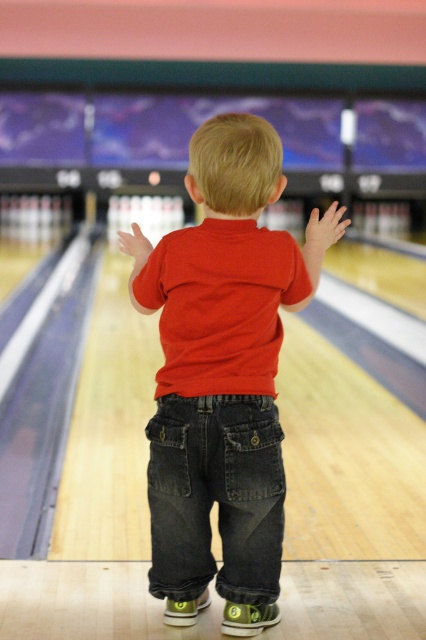
Is red cotton shirt at center to the right of dark blue denim jeans at center from the viewer's perspective?

Yes, red cotton shirt at center is to the right of dark blue denim jeans at center.

Is point (161, 248) positioned after point (264, 413)?

That is True.

Is point (221, 321) positioned behind point (264, 556)?

No, it is not.

The height and width of the screenshot is (640, 426). I want to click on red cotton shirt at center, so click(x=222, y=372).